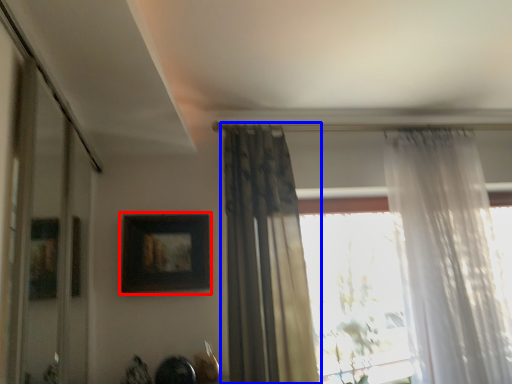
Question: Which object appears farthest to the camera in this image, picture frame (highlighted by a red box) or curtain (highlighted by a blue box)?

Choices:
 (A) picture frame
 (B) curtain

Answer: (A)